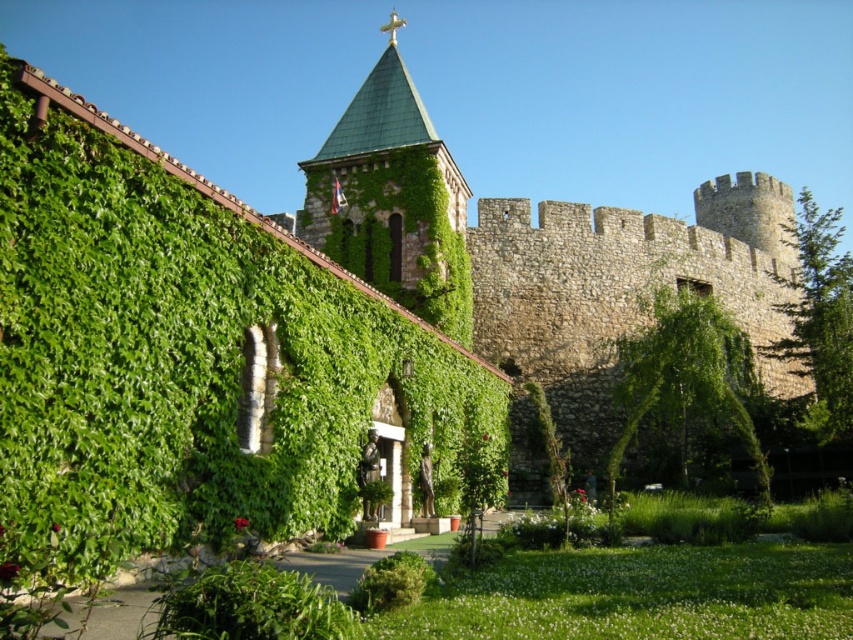
Question: Which of the following is the closest to the observer?

Choices:
 (A) (403, 147)
 (B) (846, 397)
 (C) (724, 360)

Answer: (A)

Question: Can you confirm if green ivy-covered church at center is wider than green leafy tree at right?

Choices:
 (A) no
 (B) yes

Answer: (B)

Question: Among these objects, which one is farthest from the camera?

Choices:
 (A) green leafy tree at right
 (B) green ivy-covered church at center
 (C) green leafy tree at center

Answer: (A)

Question: Can you confirm if green ivy-covered church at center is smaller than green leafy tree at right?

Choices:
 (A) no
 (B) yes

Answer: (B)

Question: Among these objects, which one is nearest to the camera?

Choices:
 (A) green leafy tree at right
 (B) green leafy tree at center

Answer: (B)

Question: Does green ivy-covered church at center lie behind green leafy tree at center?

Choices:
 (A) no
 (B) yes

Answer: (B)